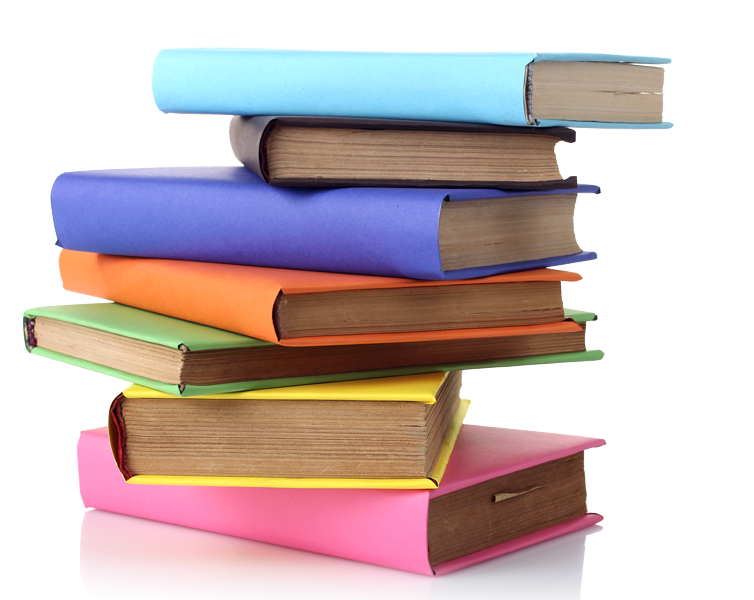
Where is `book pages`? book pages is located at coordinates [489, 516], [329, 442], [173, 367], [437, 307], [504, 250], [495, 150], [572, 106].